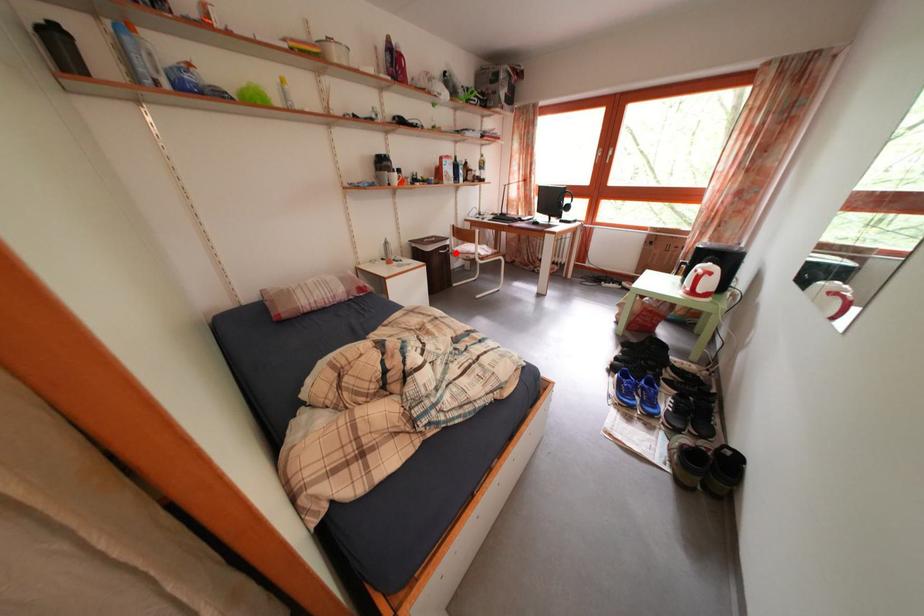
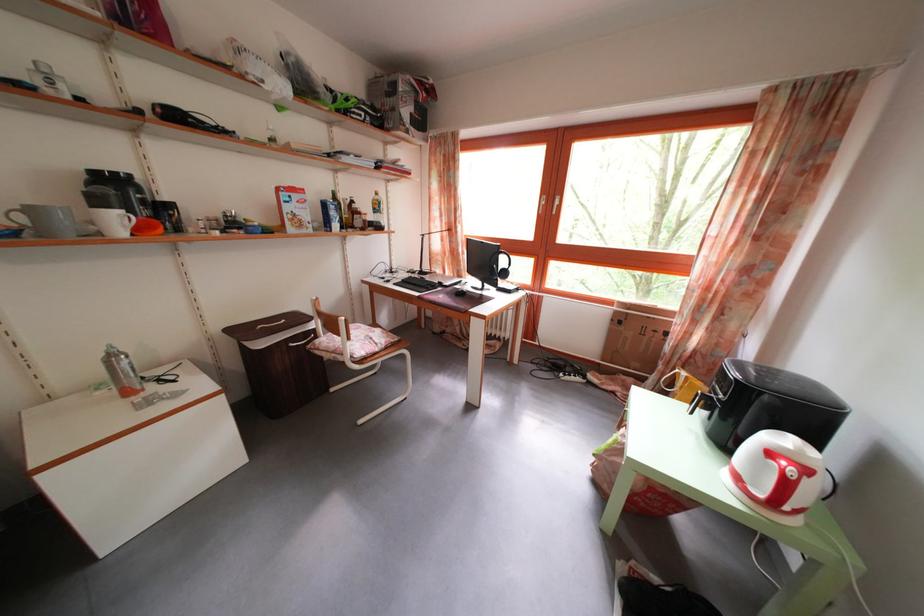
Question: I am providing you with two images of the same scene from different viewpoints. Given a red point in image1, look at the same physical point in image2. Is it:

Choices:
 (A) Closer to the viewpoint
 (B) Farther from the viewpoint

Answer: (B)